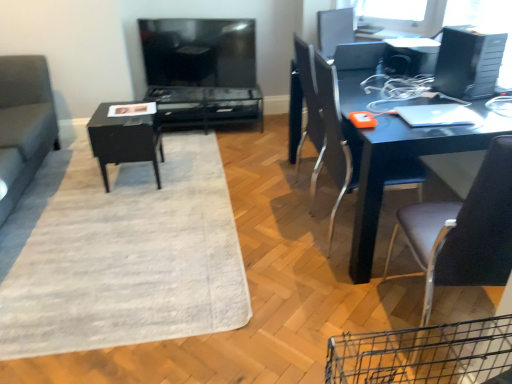
Question: Looking at the image, does black glossy table at center, which appears as the 2th table when viewed from the back, seem bigger or smaller compared to metallic blue desk at right?

Choices:
 (A) small
 (B) big

Answer: (A)

Question: Is black glossy table at center, which is the first table in front-to-back order, spatially inside metallic blue desk at right, or outside of it?

Choices:
 (A) inside
 (B) outside

Answer: (B)

Question: Considering the real-world distances, which object is farthest from the matte black chair at right, the 1th chair when ordered from back to front?

Choices:
 (A) suede gray couch at left
 (B) leather-like brown chair at right, which is counted as the 2th chair, starting from the back
 (C) metallic blue desk at right
 (D) black glossy table at center, which appears as the 2th table when viewed from the back
 (E) black plastic desktop computer at upper right

Answer: (A)

Question: Which object is positioned closest to the matte black chair at right, the 1th chair when ordered from back to front?

Choices:
 (A) silver metallic laptop at upper right
 (B) metallic blue desk at right
 (C) black glossy table at center, which appears as the 2th table when viewed from the back
 (D) black plastic desktop computer at upper right
 (E) matte black tv at upper center

Answer: (B)